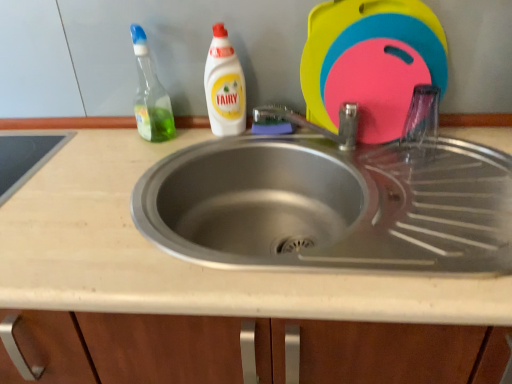
Image resolution: width=512 pixels, height=384 pixels. Identify the location of vacant area that lies between green translucent bottle at upper left, placed as the 1th cleaning product when sorted from left to right, and white plastic bottle at upper center, positioned as the 1th cleaning product in right-to-left order. (194, 137).